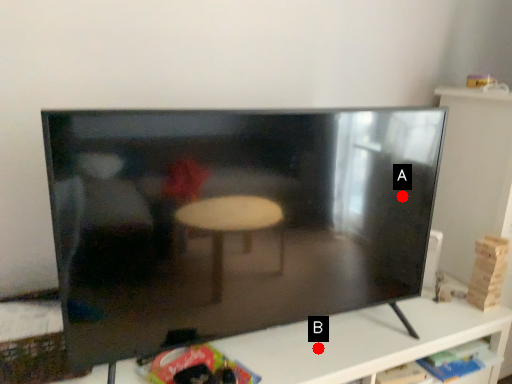
Question: Two points are circled on the image, labeled by A and B beside each circle. Which point is closer to the camera taking this photo?

Choices:
 (A) A is closer
 (B) B is closer

Answer: (B)